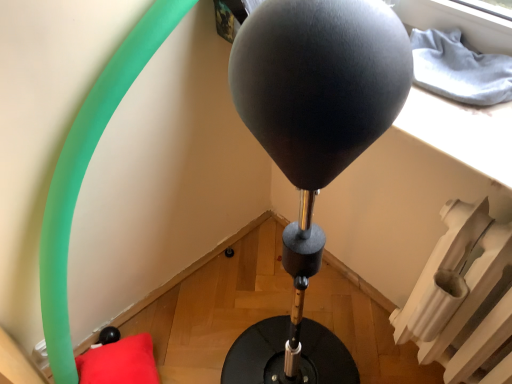
Question: Is white plastic radiator at lower right positioned with its back to red plush pillow at lower left?

Choices:
 (A) yes
 (B) no

Answer: (B)

Question: Considering the relative sizes of white plastic radiator at lower right and red plush pillow at lower left in the image provided, is white plastic radiator at lower right taller than red plush pillow at lower left?

Choices:
 (A) no
 (B) yes

Answer: (B)

Question: Does white plastic radiator at lower right have a lesser height compared to red plush pillow at lower left?

Choices:
 (A) yes
 (B) no

Answer: (B)

Question: Is white plastic radiator at lower right bigger than red plush pillow at lower left?

Choices:
 (A) no
 (B) yes

Answer: (B)

Question: Considering the relative positions of white plastic radiator at lower right and red plush pillow at lower left in the image provided, is white plastic radiator at lower right to the right of red plush pillow at lower left from the viewer's perspective?

Choices:
 (A) yes
 (B) no

Answer: (A)

Question: Can you confirm if white plastic radiator at lower right is wider than red plush pillow at lower left?

Choices:
 (A) no
 (B) yes

Answer: (A)

Question: Does black matte balloon at center have a greater width compared to red plush pillow at lower left?

Choices:
 (A) no
 (B) yes

Answer: (B)

Question: Does black matte balloon at center have a lesser height compared to red plush pillow at lower left?

Choices:
 (A) no
 (B) yes

Answer: (B)

Question: Is black matte balloon at center not close to red plush pillow at lower left?

Choices:
 (A) no
 (B) yes

Answer: (B)

Question: Does black matte balloon at center have a lesser width compared to red plush pillow at lower left?

Choices:
 (A) yes
 (B) no

Answer: (B)

Question: Is black matte balloon at center next to red plush pillow at lower left?

Choices:
 (A) no
 (B) yes

Answer: (A)

Question: Can you confirm if black matte balloon at center is taller than red plush pillow at lower left?

Choices:
 (A) yes
 (B) no

Answer: (B)

Question: Is red plush pillow at lower left not within black matte balloon at center?

Choices:
 (A) yes
 (B) no

Answer: (A)